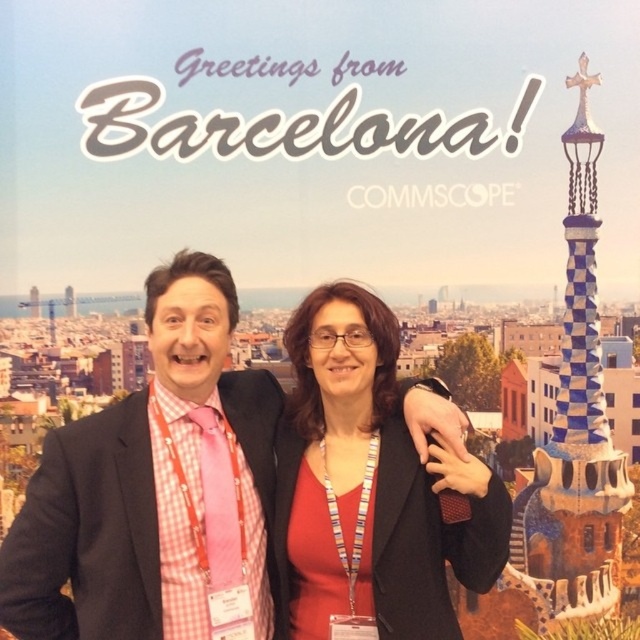
Does pink checkered shirt at center appear under matte black jacket at center?

Indeed, pink checkered shirt at center is positioned under matte black jacket at center.

Looking at this image, does pink checkered shirt at center have a greater height compared to matte black jacket at center?

Yes, pink checkered shirt at center is taller than matte black jacket at center.

This screenshot has width=640, height=640. I want to click on pink checkered shirt at center, so click(154, 486).